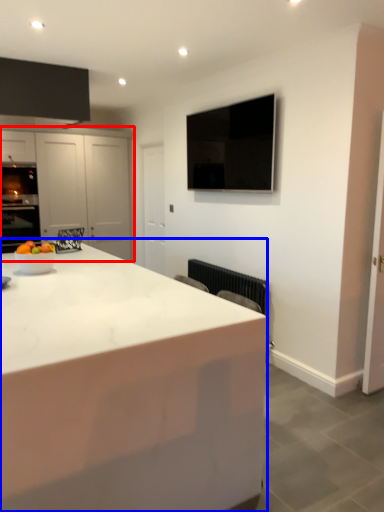
Question: Which object appears farthest to the camera in this image, cabinetry (highlighted by a red box) or countertop (highlighted by a blue box)?

Choices:
 (A) cabinetry
 (B) countertop

Answer: (A)